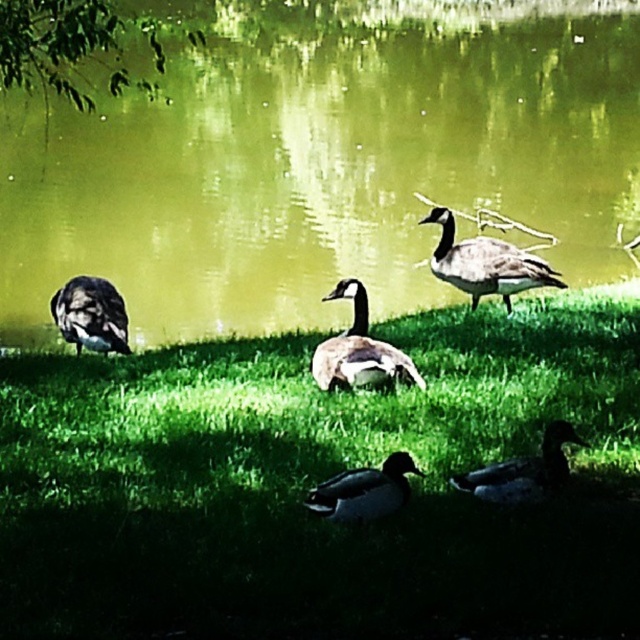
You are a photographer aiming to capture a clear shot of the gray feathered goose at upper right and the dark brown feathers at lower left. Which object should you focus on first to ensure it appears sharp in the foreground?

The gray feathered goose at upper right should be focused on first because it is in the foreground, while the dark brown feathers at lower left are behind it.

You are a photographer aiming to capture a clear shot of the brown feathered goose at center and the green liquid water at center. Which object will appear closer to the camera in the photo?

The green liquid water at center appears closer to the camera because it is taller than the brown feathered goose at center, indicating it is positioned in front of the goose.

In the scene shown: You are a photographer aiming to capture the brown feathered goose at center and the green liquid water at center in the same frame. Based on their positions, which object should you adjust your camera to focus on first to ensure both are in the shot?

The green liquid water at center is positioned on the left side of brown feathered goose at center, so you should focus on the brown feathered goose at center first to ensure both are included in the frame.